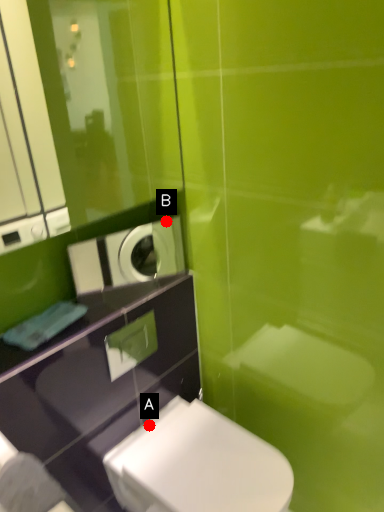
Question: Two points are circled on the image, labeled by A and B beside each circle. Which point is farther from the camera taking this photo?

Choices:
 (A) A is further
 (B) B is further

Answer: (B)